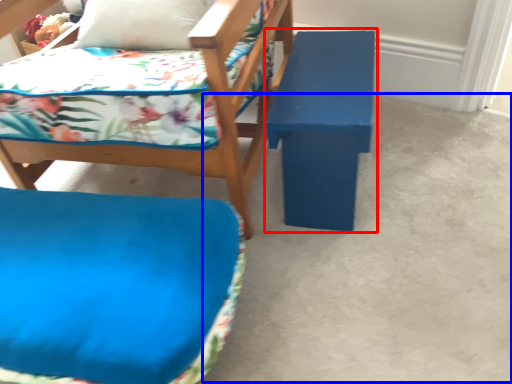
Question: Among these objects, which one is farthest to the camera, table (highlighted by a red box) or concrete (highlighted by a blue box)?

Choices:
 (A) table
 (B) concrete

Answer: (A)